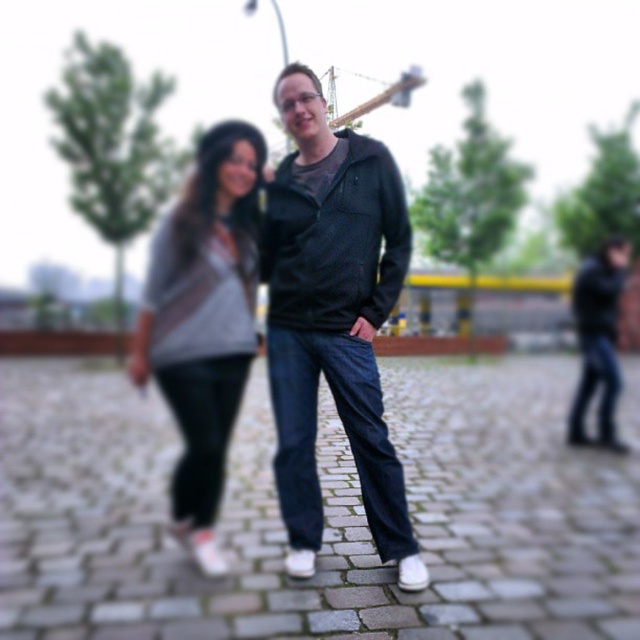
You are a photographer trying to capture a portrait of the two people in the image. The matte black jacket at center is at point 0.498, 0.520. If you want to ensure the jacket is centered in the frame, where should you position your camera? Please provide coordinates as a point between 0 and 1 in both x and y axes.

To center the matte black jacket at center, position the camera at the coordinates (332, 317), which is the exact location of the jacket in the image.

You are a fashion designer observing two items in an image. The items are the matte gray sweater at center and the dark blue jeans at right. Which item appears smaller in the image?

The matte gray sweater at center is smaller than the dark blue jeans at right.

You are a delivery robot with a box that is 16 feet long. You need to navigate between the matte black jacket at center and dark blue jeans at right. Can your box fit through the space between them?

The distance between the matte black jacket at center and dark blue jeans at right is 15.94 feet, which is slightly less than the 16 feet length of the box. Therefore, the box cannot fit through the space between them.